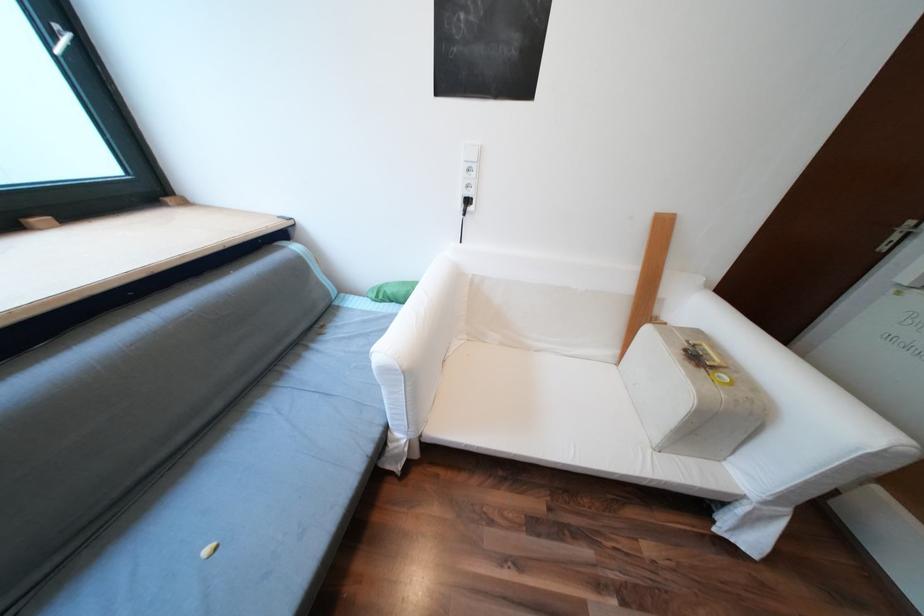
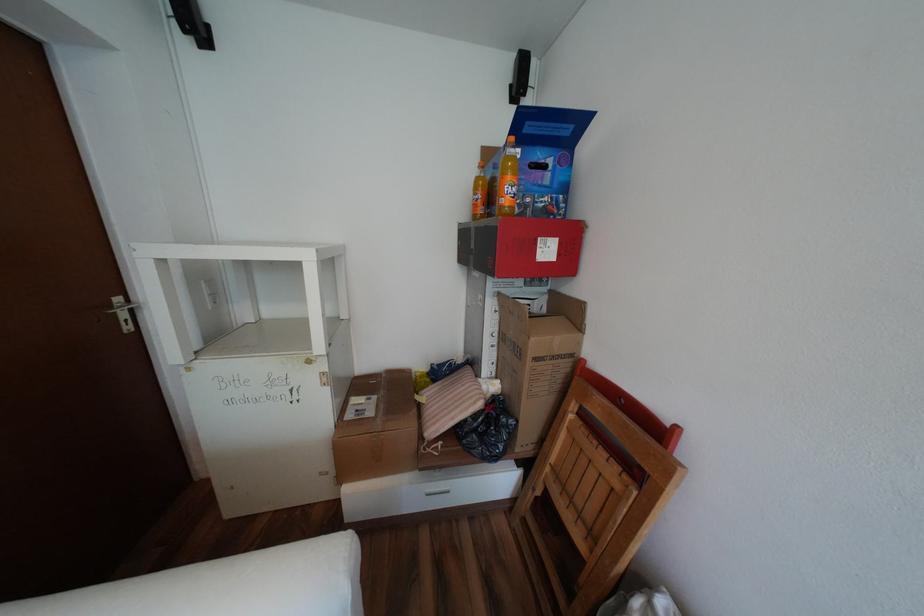
The first image is from the beginning of the video and the second image is from the end. How did the camera likely rotate when shooting the video?

The camera's rotation is toward right-down.